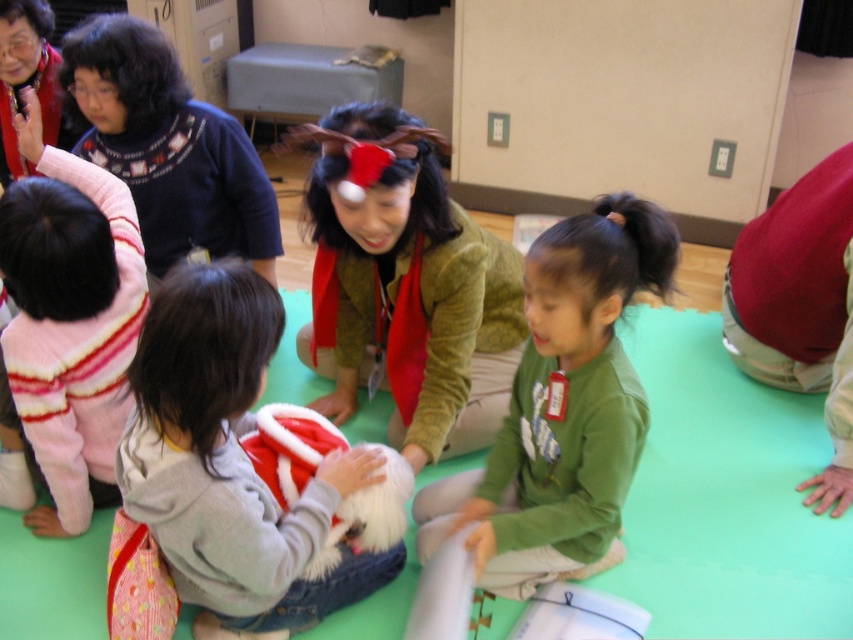
In the scene shown: You are standing at the origin point in the image. The gray fleece hoodie at center is located at point (231, 465). If you want to move towards the gray fleece hoodie at center, which direction should you move? Please provide your answer in terms of the coordinate system where the origin is at the bottom left corner of the image, with the x and y axes increasing to the right and up respectively.

Since the gray fleece hoodie at center is located at point (231, 465), you should move towards the right and upwards from the origin point to reach it.

You are a teacher in the classroom and need to locate the gray fleece hoodie at center. Where exactly is it located in the room?

The gray fleece hoodie at center is located at point (231,465) in the room.

You are standing in the classroom where the children are playing. There is a point marked at coordinates [561,406]. Which object from the scene is this point located on?

The point at coordinates [561,406] is located on the green matte shirt at center.